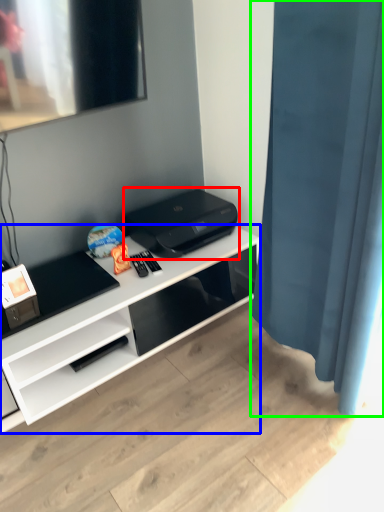
Question: Considering the real-world distances, which object is farthest from printer (highlighted by a red box)? desk (highlighted by a blue box) or shower curtain (highlighted by a green box)?

Choices:
 (A) desk
 (B) shower curtain

Answer: (B)